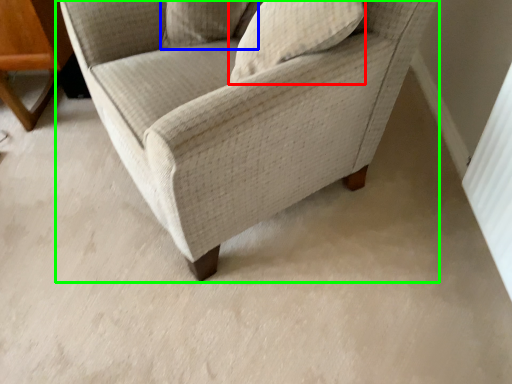
Question: Which object is positioned closest to pillow (highlighted by a red box)? Select from pillow (highlighted by a blue box) and chair (highlighted by a green box).

Choices:
 (A) pillow
 (B) chair

Answer: (B)